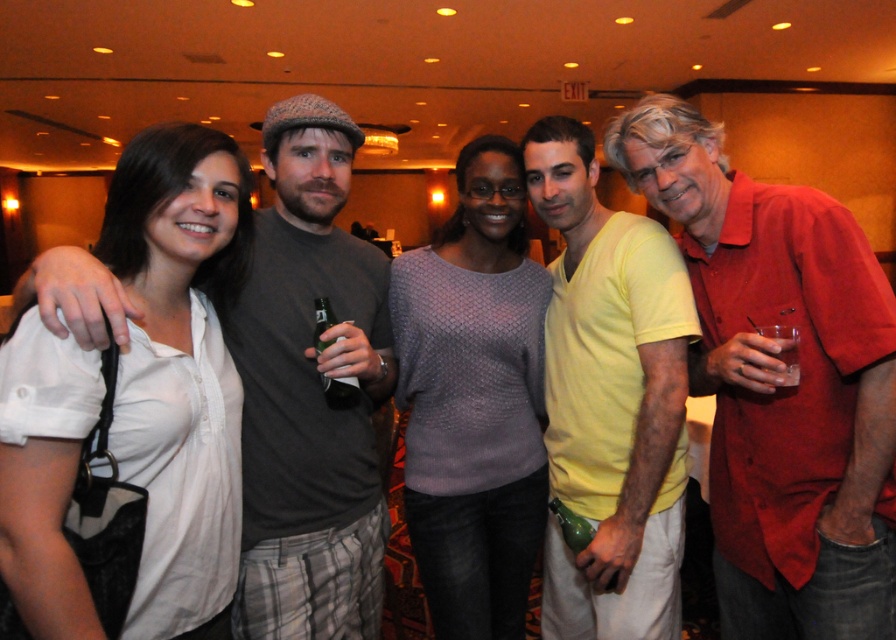
Question: Is white matte shirt at left above green matte bottle at center?

Choices:
 (A) no
 (B) yes

Answer: (B)

Question: Among these points, which one is nearest to the camera?

Choices:
 (A) (226, 305)
 (B) (769, 337)

Answer: (B)

Question: Which point is farther to the camera?

Choices:
 (A) matte red shirt at right
 (B) yellow matte shirt at center
 (C) green matte bottle at center
 (D) knitted purple sweater at center

Answer: (D)

Question: Estimate the real-world distances between objects in this image. Which object is closer to the white matte shirt at left?

Choices:
 (A) knitted purple sweater at center
 (B) yellow matte shirt at center

Answer: (A)

Question: Observing the image, what is the correct spatial positioning of white matte shirt at left in reference to yellow matte shirt at center?

Choices:
 (A) above
 (B) below

Answer: (A)

Question: Does white matte shirt at left have a smaller size compared to yellow matte shirt at center?

Choices:
 (A) yes
 (B) no

Answer: (A)